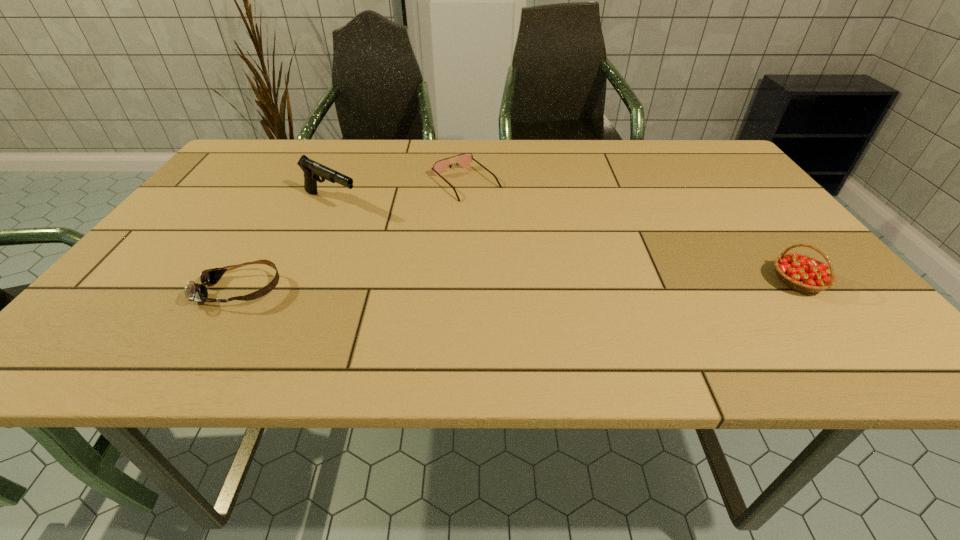
I want to click on vacant space at the far edge, so click(x=565, y=159).

Find the location of `free space at the near edge`. free space at the near edge is located at coordinates (715, 302).

Identify the location of vacant region at the left edge of the desktop. The height and width of the screenshot is (540, 960). coord(189,269).

The width and height of the screenshot is (960, 540). Identify the location of vacant space at the right edge of the desktop. 765,210.

At what (x,y) coordinates should I click in order to perform the action: click on vacant space at the far left corner of the desktop. Please return your answer as a coordinate pair (x, y). The width and height of the screenshot is (960, 540). Looking at the image, I should click on (279, 169).

Locate an element on the screen. The height and width of the screenshot is (540, 960). free space at the far right corner of the desktop is located at coordinates (682, 158).

Where is `free area in between the goggles and the third shortest object`? free area in between the goggles and the third shortest object is located at coordinates (519, 286).

The image size is (960, 540). In order to click on free area in between the strawberry and the gun in this screenshot , I will do `click(564, 242)`.

Find the location of a particular element. unoccupied area between the goggles and the gun is located at coordinates (286, 246).

Identify the location of vacant area between the strawberry and the sunglasses. The height and width of the screenshot is (540, 960). click(x=632, y=232).